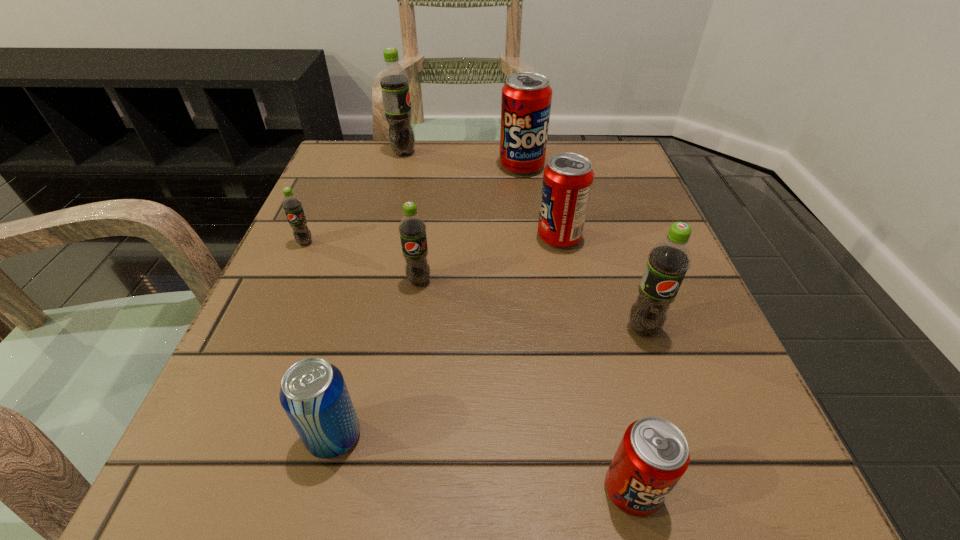
The width and height of the screenshot is (960, 540). I want to click on vacant space at the right edge of the desktop, so click(x=699, y=301).

This screenshot has height=540, width=960. What are the coordinates of `free spot at the far right corner of the desktop` in the screenshot? It's located at (647, 192).

Locate an element on the screen. The width and height of the screenshot is (960, 540). vacant space at the near right corner of the desktop is located at coordinates (723, 476).

This screenshot has width=960, height=540. I want to click on vacant area that lies between the second nearest red soda can and the third farthest green soda, so click(489, 259).

What are the coordinates of `vacant point located between the tallest soda can and the seventh farthest object` in the screenshot? It's located at (369, 294).

This screenshot has height=540, width=960. Identify the location of free spot between the leftmost soda can and the rightmost green soda. click(474, 286).

Where is `vacant space in between the biggest red soda can and the biggest green soda`? vacant space in between the biggest red soda can and the biggest green soda is located at coordinates (463, 159).

I want to click on vacant space in between the second farthest red soda can and the leftmost soda can, so click(432, 240).

What are the coordinates of `empty space between the farthest red soda can and the rightmost soda can` in the screenshot? It's located at (583, 247).

You are a GUI agent. You are given a task and a screenshot of the screen. Output one action in this format:
    pyautogui.click(x=<x>, y=<y>)
    Task: Click on the vacant space that's between the farthest red soda can and the beer can
    
    Given the screenshot: What is the action you would take?
    pyautogui.click(x=428, y=301)